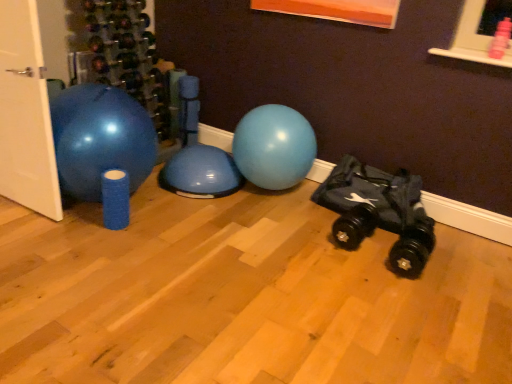
Question: Is white matte door at left further to the viewer compared to black fabric baby carriage at lower right?

Choices:
 (A) yes
 (B) no

Answer: (B)

Question: Does white matte door at left have a lesser height compared to black fabric baby carriage at lower right?

Choices:
 (A) yes
 (B) no

Answer: (B)

Question: Could you tell me if white matte door at left is turned towards black fabric baby carriage at lower right?

Choices:
 (A) yes
 (B) no

Answer: (B)

Question: Is white matte door at left positioned before black fabric baby carriage at lower right?

Choices:
 (A) yes
 (B) no

Answer: (A)

Question: From a real-world perspective, is white matte door at left over black fabric baby carriage at lower right?

Choices:
 (A) yes
 (B) no

Answer: (A)

Question: Is white matte door at left far from black fabric baby carriage at lower right?

Choices:
 (A) yes
 (B) no

Answer: (A)

Question: From a real-world perspective, is black fabric baby carriage at lower right beneath white matte door at left?

Choices:
 (A) yes
 (B) no

Answer: (A)

Question: Can you confirm if black fabric baby carriage at lower right is wider than white matte door at left?

Choices:
 (A) yes
 (B) no

Answer: (A)

Question: From the image's perspective, would you say black fabric baby carriage at lower right is shown under white matte door at left?

Choices:
 (A) no
 (B) yes

Answer: (B)

Question: From the image's perspective, is black fabric baby carriage at lower right over white matte door at left?

Choices:
 (A) yes
 (B) no

Answer: (B)

Question: Is the position of black fabric baby carriage at lower right more distant than that of white matte door at left?

Choices:
 (A) no
 (B) yes

Answer: (B)

Question: Considering the relative sizes of black fabric baby carriage at lower right and white matte door at left in the image provided, is black fabric baby carriage at lower right shorter than white matte door at left?

Choices:
 (A) yes
 (B) no

Answer: (A)

Question: Based on their sizes in the image, would you say white matte door at left is bigger or smaller than black fabric baby carriage at lower right?

Choices:
 (A) small
 (B) big

Answer: (B)